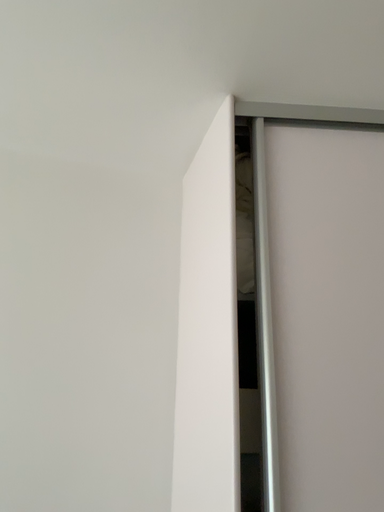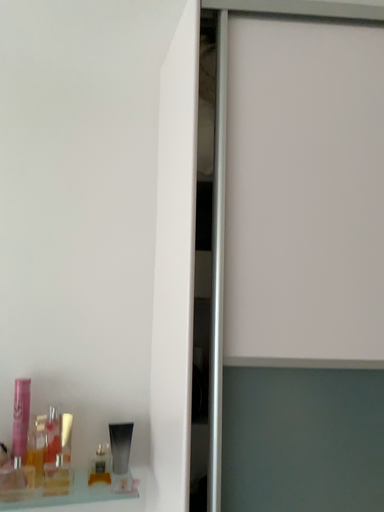
Question: Which way did the camera rotate in the video?

Choices:
 (A) rotated downward
 (B) rotated upward

Answer: (A)